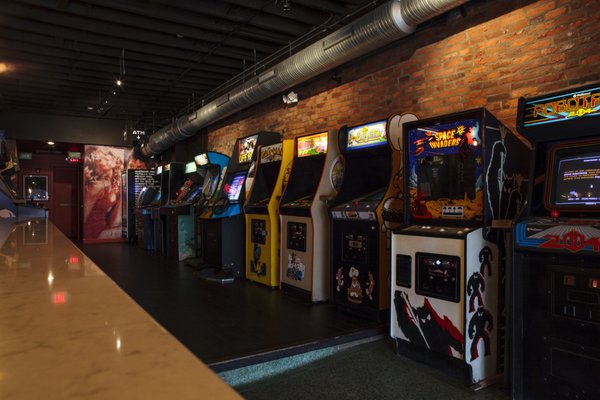
This screenshot has width=600, height=400. Identify the location of exit door. (67, 210).